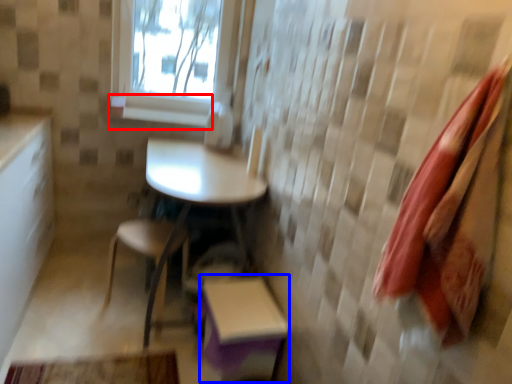
Question: Which object appears closest to the camera in this image, window sill (highlighted by a red box) or step stool (highlighted by a blue box)?

Choices:
 (A) window sill
 (B) step stool

Answer: (B)